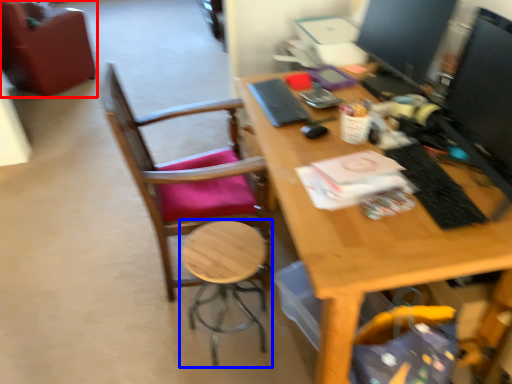
Question: Which object is further to the camera taking this photo, chair (highlighted by a red box) or stool (highlighted by a blue box)?

Choices:
 (A) chair
 (B) stool

Answer: (A)